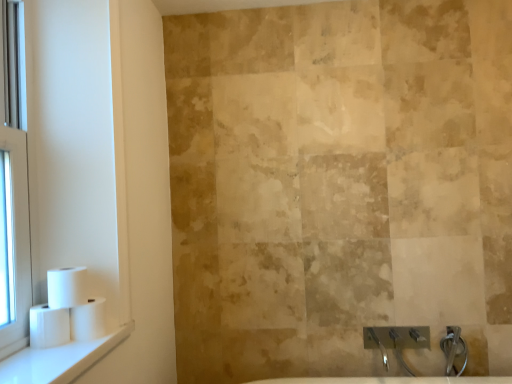
Question: Is white matte toilet paper at left, which ranks as the 1th toilet paper in right-to-left order, oriented towards clear glass window at left?

Choices:
 (A) no
 (B) yes

Answer: (A)

Question: Is white matte toilet paper at left, which ranks as the 1th toilet paper in right-to-left order, facing away from clear glass window at left?

Choices:
 (A) yes
 (B) no

Answer: (B)

Question: From a real-world perspective, is white matte toilet paper at left, which ranks as the 1th toilet paper in right-to-left order, on clear glass window at left?

Choices:
 (A) yes
 (B) no

Answer: (B)

Question: From the image's perspective, is white matte toilet paper at left, placed as the third toilet paper when sorted from left to right, located above clear glass window at left?

Choices:
 (A) no
 (B) yes

Answer: (A)

Question: Is white matte toilet paper at left, which ranks as the 1th toilet paper in right-to-left order, shorter than clear glass window at left?

Choices:
 (A) yes
 (B) no

Answer: (A)

Question: Is white matte toilet paper at left, which ranks as the 1th toilet paper in right-to-left order, outside of clear glass window at left?

Choices:
 (A) yes
 (B) no

Answer: (A)

Question: Is white glossy window sill at lower left not near clear glass window at left?

Choices:
 (A) no
 (B) yes

Answer: (A)

Question: From the image's perspective, is white glossy window sill at lower left under clear glass window at left?

Choices:
 (A) no
 (B) yes

Answer: (B)

Question: Can you confirm if white glossy window sill at lower left is shorter than clear glass window at left?

Choices:
 (A) yes
 (B) no

Answer: (A)

Question: Can you confirm if white glossy window sill at lower left is thinner than clear glass window at left?

Choices:
 (A) no
 (B) yes

Answer: (A)

Question: Is white glossy window sill at lower left taller than clear glass window at left?

Choices:
 (A) no
 (B) yes

Answer: (A)

Question: Is white glossy window sill at lower left turned away from clear glass window at left?

Choices:
 (A) yes
 (B) no

Answer: (A)

Question: Considering the relative sizes of clear glass window at left and white glossy window sill at lower left in the image provided, is clear glass window at left thinner than white glossy window sill at lower left?

Choices:
 (A) no
 (B) yes

Answer: (B)